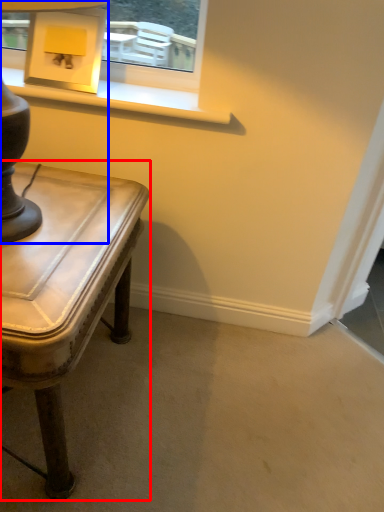
Question: Among these objects, which one is farthest to the camera, table (highlighted by a red box) or table lamp (highlighted by a blue box)?

Choices:
 (A) table
 (B) table lamp

Answer: (A)